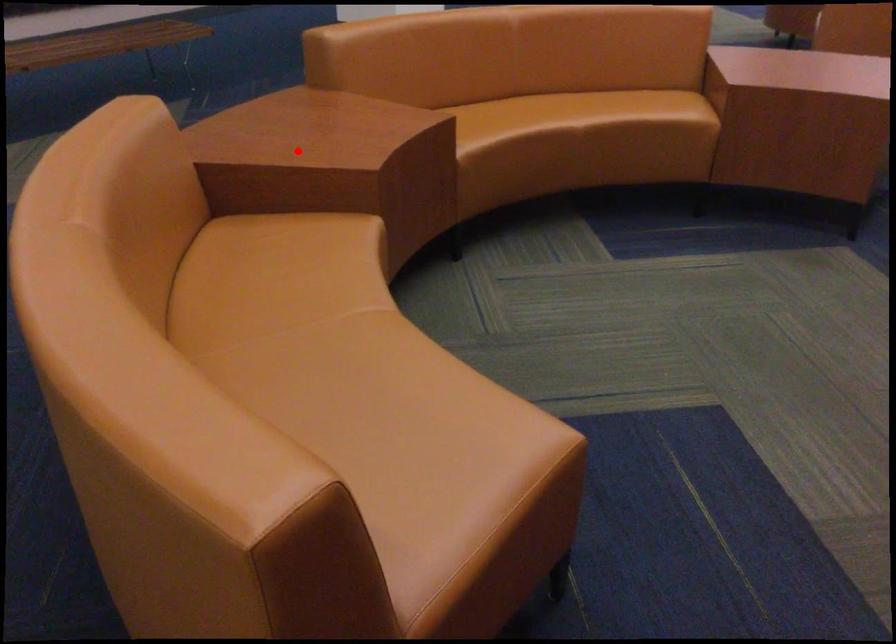
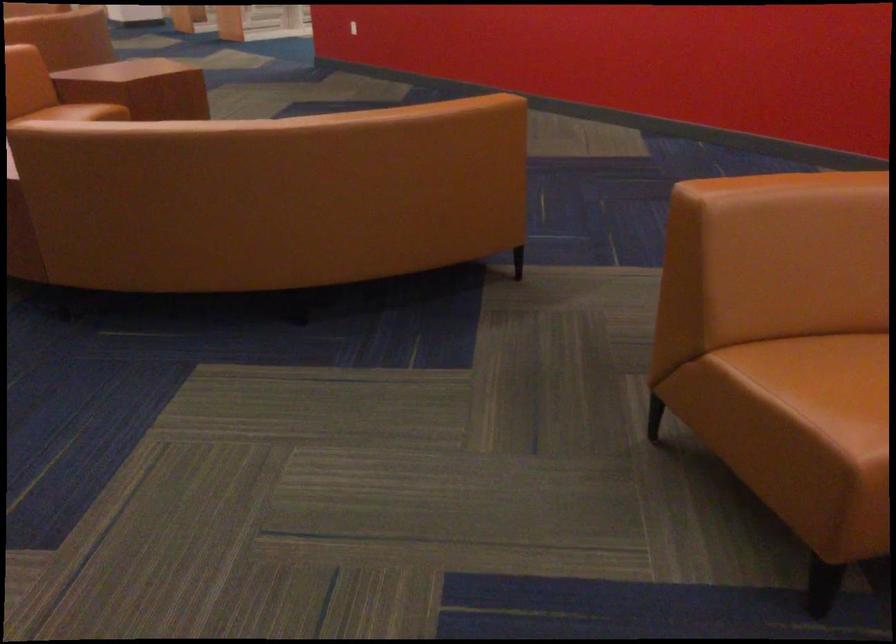
Question: I am providing you with two images of the same scene from different viewpoints. A red point is marked on the first image. Is the red point's position out of view in image 2?

Choices:
 (A) Yes
 (B) No

Answer: (A)